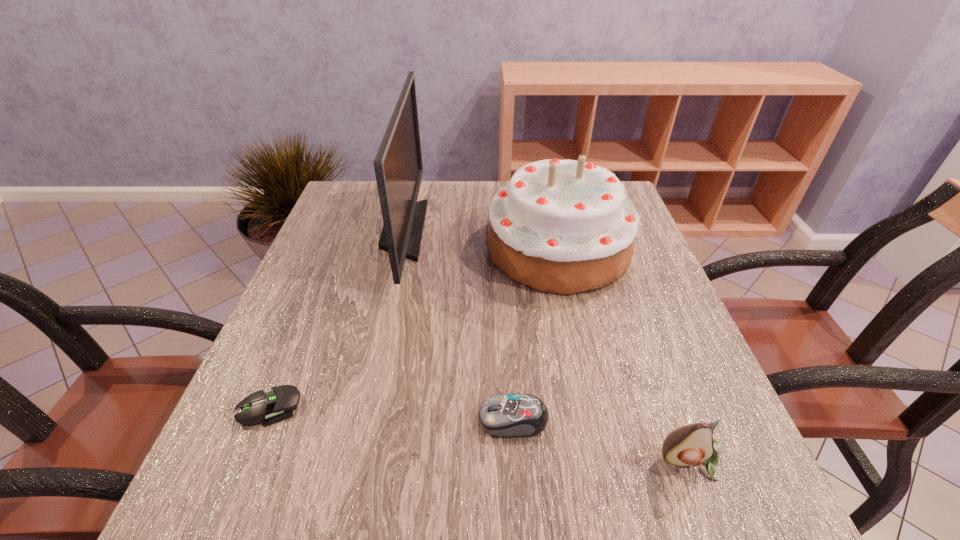
Identify the location of computer mouse situated at the left edge. (272, 406).

At what (x,y) coordinates should I click in order to perform the action: click on cake positioned at the right edge. Please return your answer as a coordinate pair (x, y). Looking at the image, I should click on (560, 226).

Where is `avocado that is at the right edge`? This screenshot has height=540, width=960. avocado that is at the right edge is located at coordinates (693, 444).

The width and height of the screenshot is (960, 540). In order to click on object present at the far left corner in this screenshot , I will do `click(398, 166)`.

At what (x,y) coordinates should I click in order to perform the action: click on object that is at the far right corner. Please return your answer as a coordinate pair (x, y). The image size is (960, 540). Looking at the image, I should click on (560, 226).

The height and width of the screenshot is (540, 960). Find the location of `object present at the near right corner`. object present at the near right corner is located at coordinates (693, 444).

Identify the location of free location at the far edge of the desktop. Image resolution: width=960 pixels, height=540 pixels. (472, 192).

Locate an element on the screen. The width and height of the screenshot is (960, 540). free region at the left edge of the desktop is located at coordinates (312, 336).

The height and width of the screenshot is (540, 960). Identify the location of free region at the right edge of the desktop. (639, 262).

Image resolution: width=960 pixels, height=540 pixels. Identify the location of vacant space at the far left corner of the desktop. (351, 191).